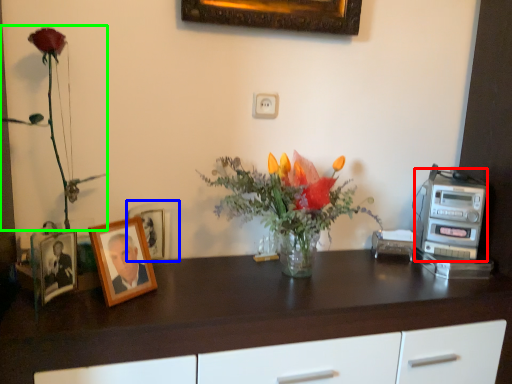
Question: Based on their relative distances, which object is nearer to appliance (highlighted by a red box)? Choose from picture frame (highlighted by a blue box) and floral arrangement (highlighted by a green box).

Choices:
 (A) picture frame
 (B) floral arrangement

Answer: (A)